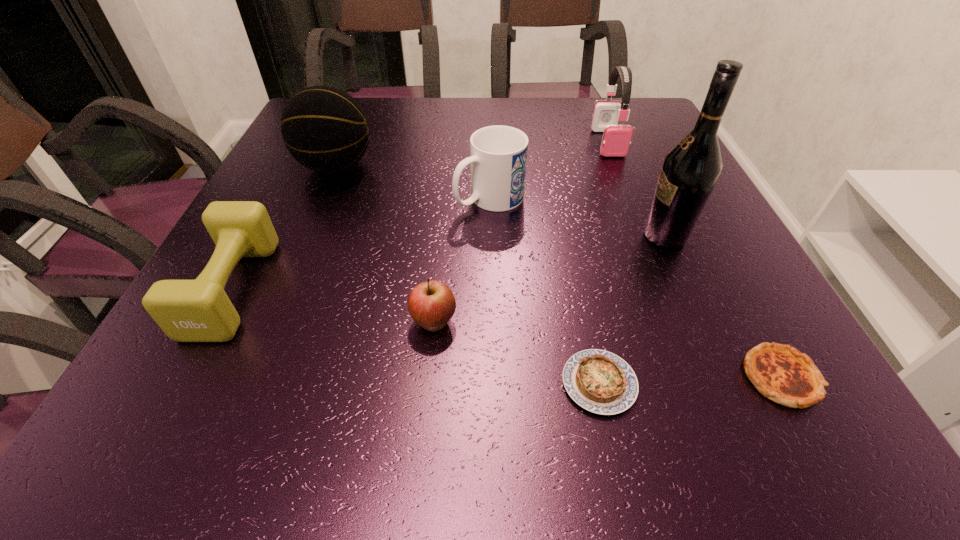
Locate an element on the screen. The image size is (960, 540). the tallest object is located at coordinates (690, 170).

This screenshot has width=960, height=540. I want to click on basketball, so click(324, 128).

You are a GUI agent. You are given a task and a screenshot of the screen. Output one action in this format:
    pyautogui.click(x=<x>, y=<y>)
    Task: Click on the earphone
    Image resolution: width=960 pixels, height=540 pixels.
    Given the screenshot: What is the action you would take?
    pyautogui.click(x=616, y=138)

The image size is (960, 540). In order to click on the fourth tallest object in this screenshot , I will do `click(498, 159)`.

In order to click on dumbbell in this screenshot , I will do `click(199, 310)`.

Where is `apple`? apple is located at coordinates (431, 304).

This screenshot has height=540, width=960. In order to click on the right quiche in this screenshot , I will do `click(781, 373)`.

Locate an element on the screen. This screenshot has height=540, width=960. the shorter quiche is located at coordinates (599, 381).

At what (x,y) coordinates should I click in order to perform the action: click on the shortest object. Please return your answer as a coordinate pair (x, y). Looking at the image, I should click on (599, 381).

Locate an element on the screen. vacant space situated on the label of the wine bottle is located at coordinates (441, 236).